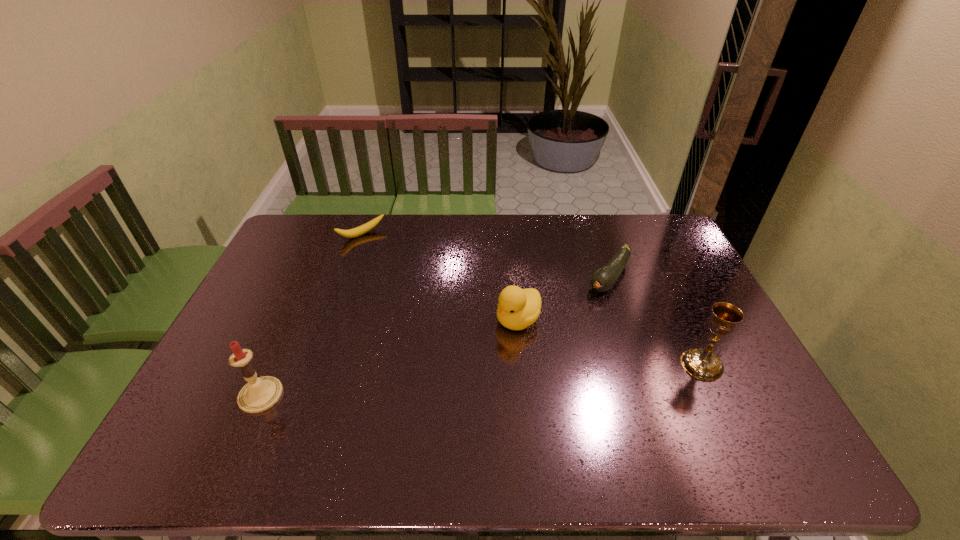
The image size is (960, 540). Identify the location of vacant space on the desktop that is between the candle and the chalice and is positioned at the blossom end of the fourth nearest object. (513, 378).

Identify the location of free space on the desktop that is between the candle and the chalice and is positioned on the front-facing side of the third nearest object. (446, 382).

Locate an element on the screen. free space on the desktop that is between the candle and the chalice and is positioned on the upward curve of the banana is located at coordinates (486, 380).